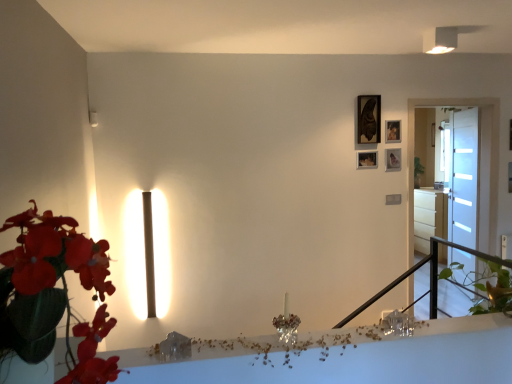
Identify the location of free space above clear glass table at center, the second table in the top-to-bottom sequence (from a real-world perspective). Image resolution: width=512 pixels, height=384 pixels. (368, 331).